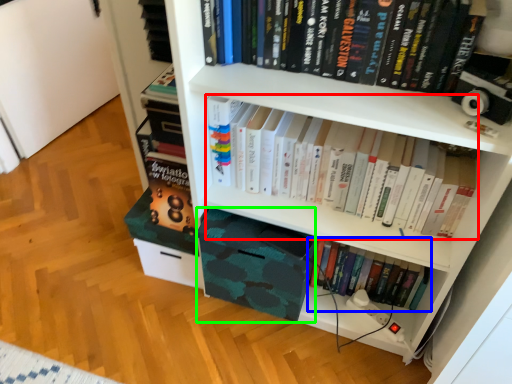
Question: Estimate the real-world distances between objects in this image. Which object is closer to book (highlighted by a red box), book (highlighted by a blue box) or book cover (highlighted by a green box)?

Choices:
 (A) book
 (B) book cover

Answer: (B)